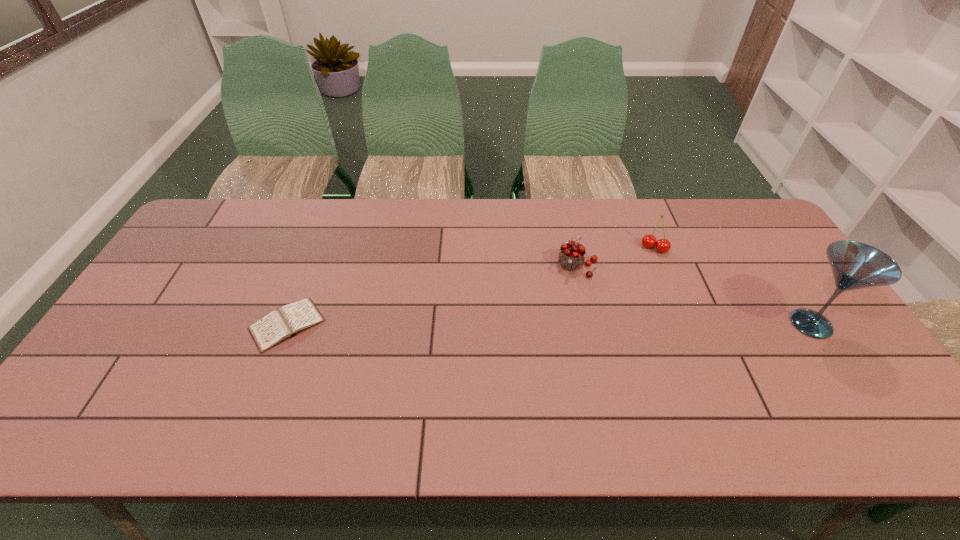
This screenshot has height=540, width=960. Identify the location of vacant space situated with the stems of the third object from left to right pointing upwards. (619, 328).

Where is `blank space located on the handle side of the second object from left to right`? This screenshot has width=960, height=540. blank space located on the handle side of the second object from left to right is located at coordinates (561, 330).

Identify the location of vacant area located on the handle side of the second object from left to right. The width and height of the screenshot is (960, 540). (561, 328).

Locate an element on the screen. The height and width of the screenshot is (540, 960). free point located on the handle side of the second object from left to right is located at coordinates (567, 298).

You are a GUI agent. You are given a task and a screenshot of the screen. Output one action in this format:
    pyautogui.click(x=<x>, y=<y>)
    Task: Click on the object at the far edge
    Image resolution: width=960 pixels, height=540 pixels.
    Given the screenshot: What is the action you would take?
    pyautogui.click(x=662, y=245)

The height and width of the screenshot is (540, 960). I want to click on object positioned at the right edge, so click(x=855, y=265).

In the image, there is a desktop. Where is `vacant space at the far edge`? The image size is (960, 540). vacant space at the far edge is located at coordinates (239, 238).

Locate an element on the screen. The height and width of the screenshot is (540, 960). vacant region at the near edge of the desktop is located at coordinates (678, 386).

Image resolution: width=960 pixels, height=540 pixels. I want to click on vacant position at the left edge of the desktop, so click(x=163, y=272).

In the image, there is a desktop. Where is `vacant space at the right edge`? Image resolution: width=960 pixels, height=540 pixels. vacant space at the right edge is located at coordinates (761, 267).